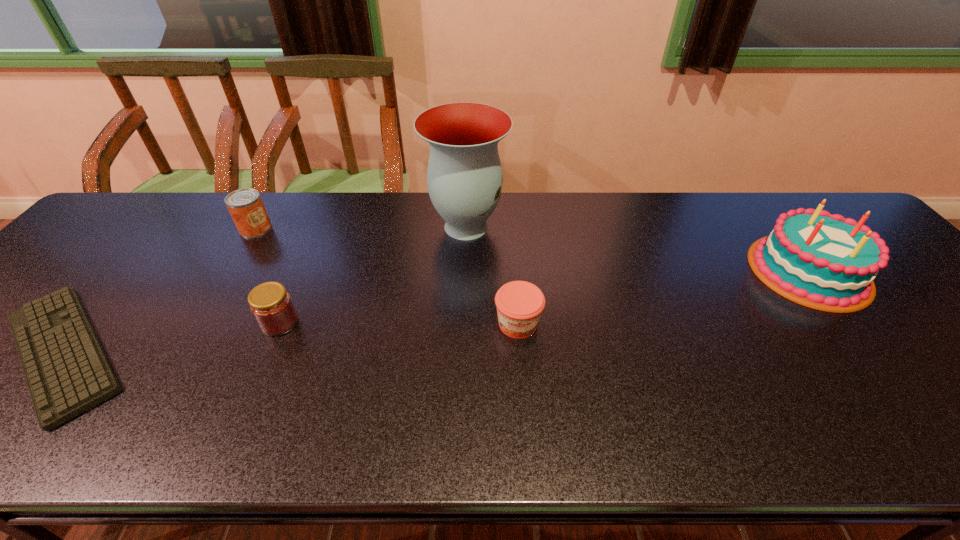
Locate an element on the screen. The height and width of the screenshot is (540, 960). vase is located at coordinates (464, 176).

Find the location of a particular element. This screenshot has width=960, height=540. the rightmost object is located at coordinates (823, 261).

Find the location of a particular element. The width and height of the screenshot is (960, 540). the fifth shortest object is located at coordinates (823, 261).

This screenshot has height=540, width=960. In order to click on can in this screenshot , I will do `click(245, 205)`.

Identify the location of the third object from left to right. Image resolution: width=960 pixels, height=540 pixels. tap(271, 305).

This screenshot has height=540, width=960. Identify the location of the right jam. (519, 304).

You are a GUI agent. You are given a task and a screenshot of the screen. Output one action in this format:
    pyautogui.click(x=<x>, y=<y>)
    Task: Click on the free location located on the front of the tallest object
    The height and width of the screenshot is (540, 960).
    Given the screenshot: What is the action you would take?
    pyautogui.click(x=462, y=352)

You are a GUI agent. You are given a task and a screenshot of the screen. Output one action in this format:
    pyautogui.click(x=<x>, y=<y>)
    Task: Click on the vacant space situated on the left of the fifth shortest object
    The image size is (960, 540).
    Given the screenshot: What is the action you would take?
    pyautogui.click(x=713, y=271)

Locate an element on the screen. vacant space situated on the left of the can is located at coordinates pos(206,228).

The width and height of the screenshot is (960, 540). Identify the location of vacant space located 0.240m on the front of the left jam. (230, 438).